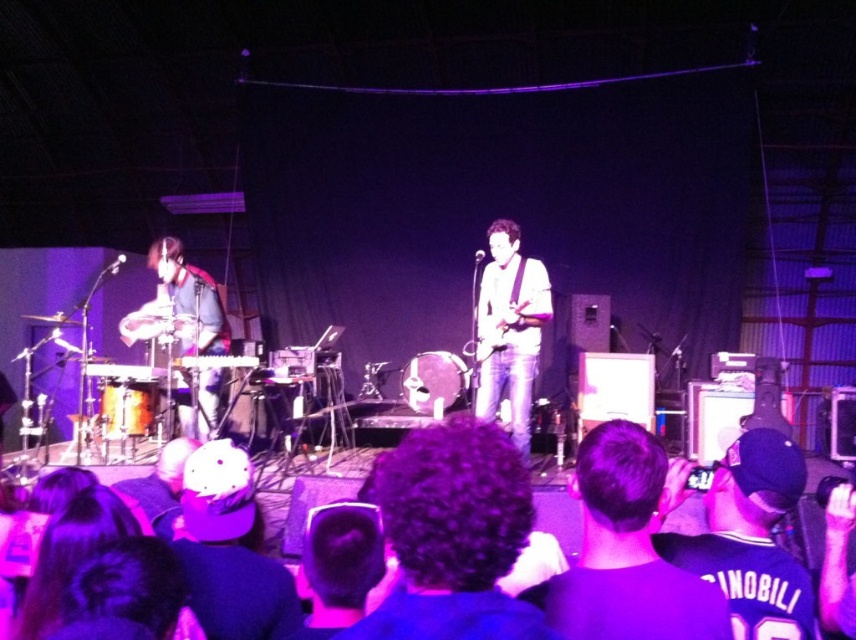
You are a stagehand who needs to move the brushed metal keyboard at left and the brushed metal drum at left to the storage room. Which one should you move first if you want to start with the one that is more to the left?

The brushed metal keyboard at left is more to the left, so you should move it first.

You are a stagehand setting up equipment. You need to place a new amplifier that requires 1.2 meters of space. The brushed metal keyboard at left and the brushed metal drum at left are both on the stage. Which object can you move to free up enough space for the amplifier?

The brushed metal drum at left is larger than the brushed metal keyboard at left, so moving the brushed metal drum at left would free up more space, potentially accommodating the amplifier requiring 1.2 meters.

You are a stagehand who needs to move a 1.2 meter wide equipment cart from the back of the stage to the front. The path must avoid the matte black drum set at left and the matte black guitar at center. Since the drum set is to the left of the guitar, can you navigate the cart through the space between them?

The matte black drum set at left is to the left of the matte black guitar at center, so there is space between them. Since the cart is 1.2 meters wide, it depends on the actual distance between the drum set and the guitar. However, the description only states their relative positions, not the exact distance. Without knowing the exact spacing, it is uncertain if the cart can fit through the space between them.